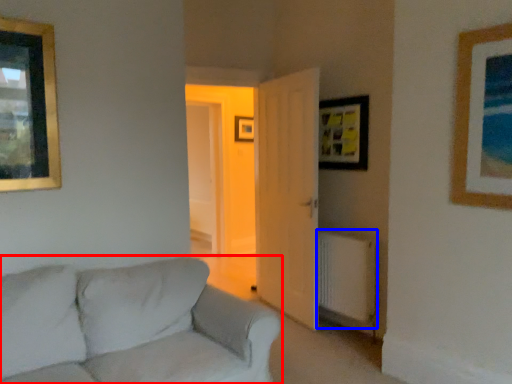
Question: Which object appears farthest to the camera in this image, studio couch (highlighted by a red box) or radiator (highlighted by a blue box)?

Choices:
 (A) studio couch
 (B) radiator

Answer: (B)